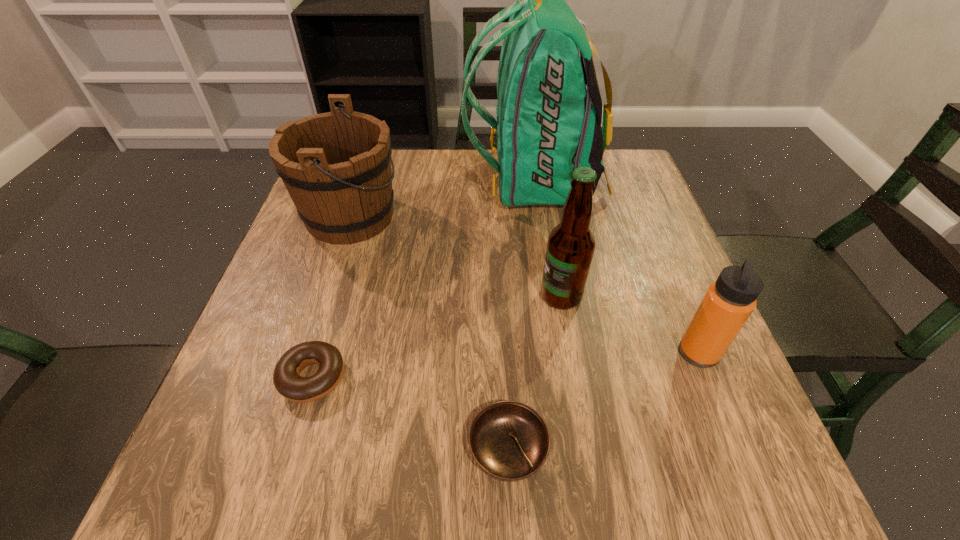
Identify the location of vacant point located between the doughnut and the soup bowl. This screenshot has width=960, height=540. (411, 414).

I want to click on free area in between the doughnut and the soup bowl, so click(411, 414).

This screenshot has width=960, height=540. I want to click on free space between the thermos bottle and the soup bowl, so click(603, 401).

Identify the location of object that stands as the second closest to the wine bucket. This screenshot has height=540, width=960. (286, 377).

Identify which object is the second nearest to the backpack. Please provide its 2D coordinates. Your answer should be formatted as a tuple, i.e. [(x, y)], where the tuple contains the x and y coordinates of a point satisfying the conditions above.

[(571, 244)]

Find the location of a particular element. free space in the image that satisfies the following two spatial constraints: 1. on the side of the wine bucket with the handle for carrying; 2. on the left side of the nearest object is located at coordinates (275, 449).

The height and width of the screenshot is (540, 960). Identify the location of free point that satisfies the following two spatial constraints: 1. on the side of the doughnut with the handle for carrying; 2. on the right side of the wine bucket. coord(298,377).

I want to click on free space in the image that satisfies the following two spatial constraints: 1. on the side of the nearest object with the handle for carrying; 2. on the right side of the wine bucket, so click(x=275, y=449).

Where is `vacant region that satisfies the following two spatial constraints: 1. on the back side of the thermos bottle; 2. on the side of the wine bucket with the handle for carrying`? This screenshot has height=540, width=960. vacant region that satisfies the following two spatial constraints: 1. on the back side of the thermos bottle; 2. on the side of the wine bucket with the handle for carrying is located at coordinates (642, 216).

Locate an element on the screen. free location that satisfies the following two spatial constraints: 1. on the side of the doughnut with the handle for carrying; 2. on the right side of the wine bucket is located at coordinates (298, 377).